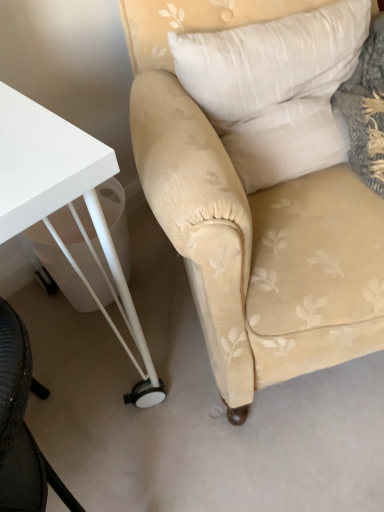
Question: Does point (82, 156) appear closer or farther from the camera than point (180, 88)?

Choices:
 (A) closer
 (B) farther

Answer: (A)

Question: Considering the positions of white glossy table at lower left and beige fabric chair at center in the image, is white glossy table at lower left taller or shorter than beige fabric chair at center?

Choices:
 (A) short
 (B) tall

Answer: (A)

Question: Considering the real-world distances, which object is farthest from the white soft pillow at upper right?

Choices:
 (A) white glossy table at lower left
 (B) beige fabric chair at center

Answer: (A)

Question: Which of these objects is positioned farthest from the white soft pillow at upper right?

Choices:
 (A) beige fabric chair at center
 (B) white glossy table at lower left

Answer: (B)